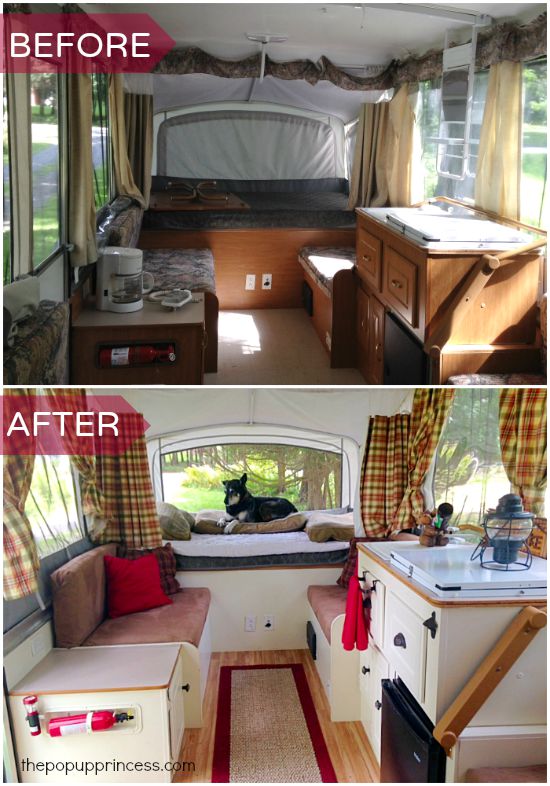
The width and height of the screenshot is (550, 786). I want to click on window, so click(x=535, y=178).